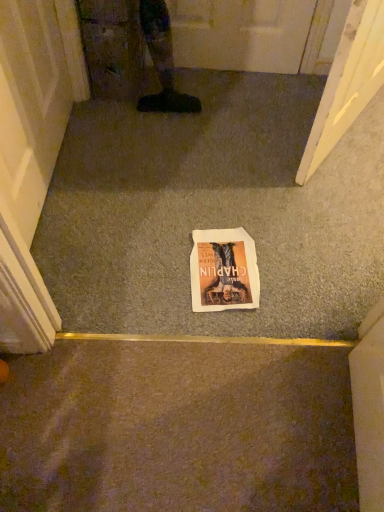
You are a GUI agent. You are given a task and a screenshot of the screen. Output one action in this format:
    pyautogui.click(x=<x>, y=<y>)
    Task: Click on the free space that is to the left of white paper comic book at center
    The image size is (384, 512).
    Given the screenshot: What is the action you would take?
    pyautogui.click(x=139, y=259)